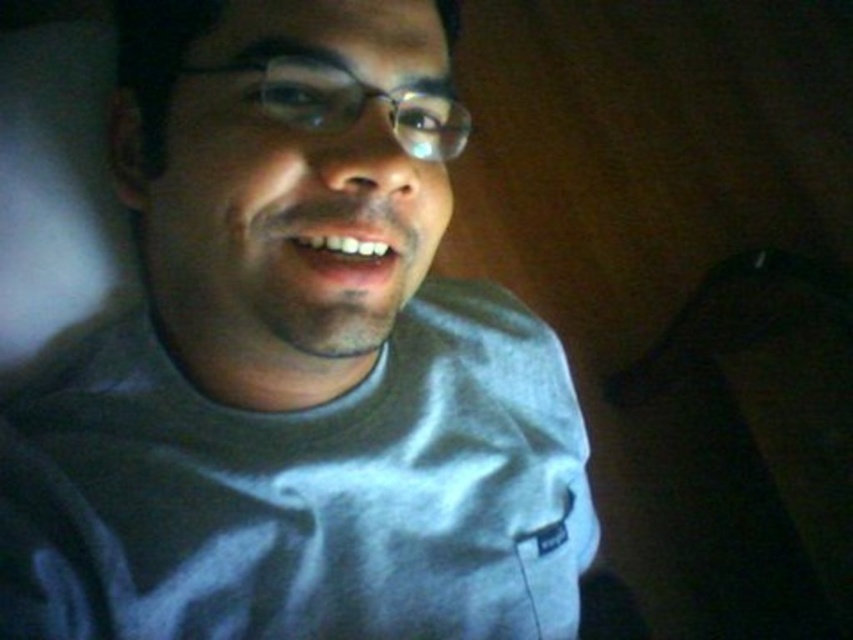
Question: Which of the following is the farthest from the observer?

Choices:
 (A) (776, 561)
 (B) (154, 298)

Answer: (A)

Question: Does gray cotton shirt at center have a smaller size compared to black fabric at lower right?

Choices:
 (A) no
 (B) yes

Answer: (B)

Question: Does gray cotton shirt at center have a lesser width compared to black fabric at lower right?

Choices:
 (A) yes
 (B) no

Answer: (B)

Question: Can you confirm if gray cotton shirt at center is positioned below black fabric at lower right?

Choices:
 (A) no
 (B) yes

Answer: (A)

Question: Which point is farther from the camera taking this photo?

Choices:
 (A) [700, 474]
 (B) [428, 339]

Answer: (A)